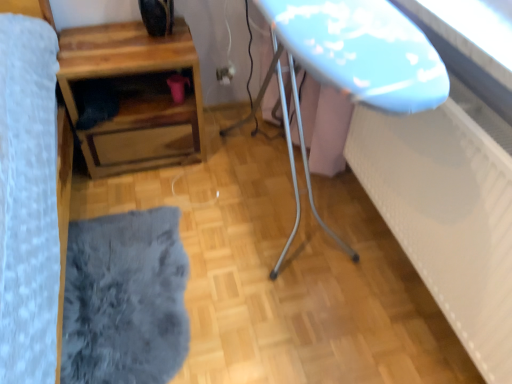
Identify the location of vacant space to the right of fuzzy gray rug at lower left. (276, 289).